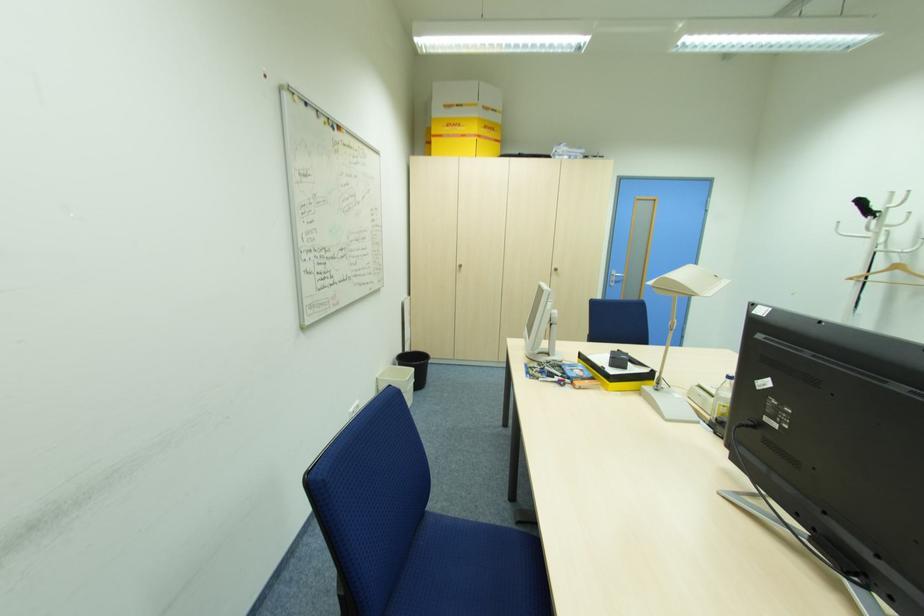
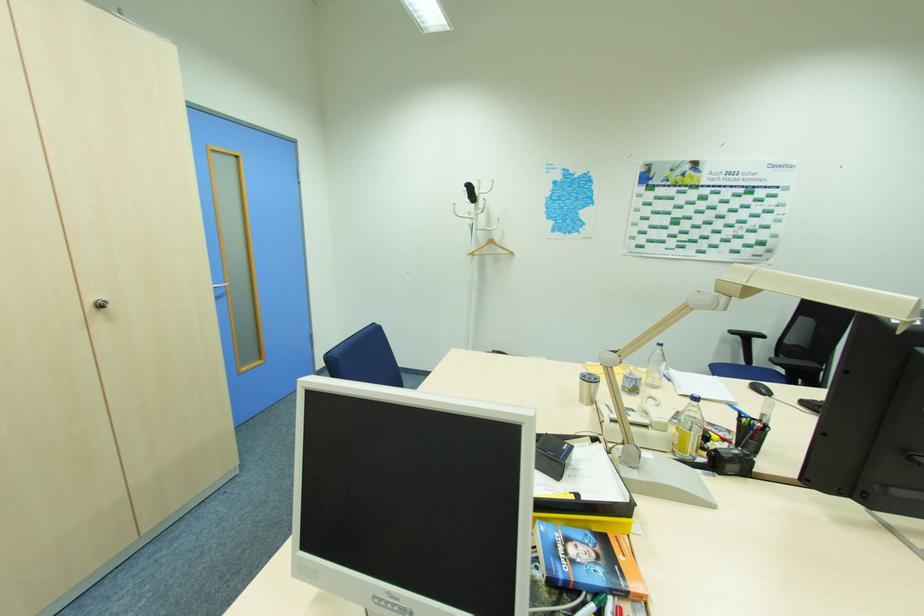
Find the pixel in the second image that matches (x=614, y=365) in the first image.

(561, 476)